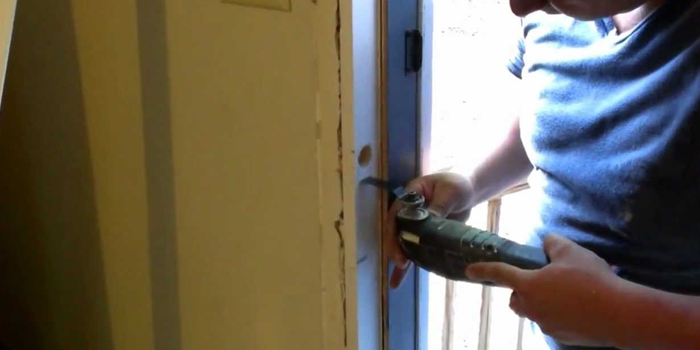
Locate an element on the screen. Image resolution: width=700 pixels, height=350 pixels. bright light is located at coordinates (455, 56).